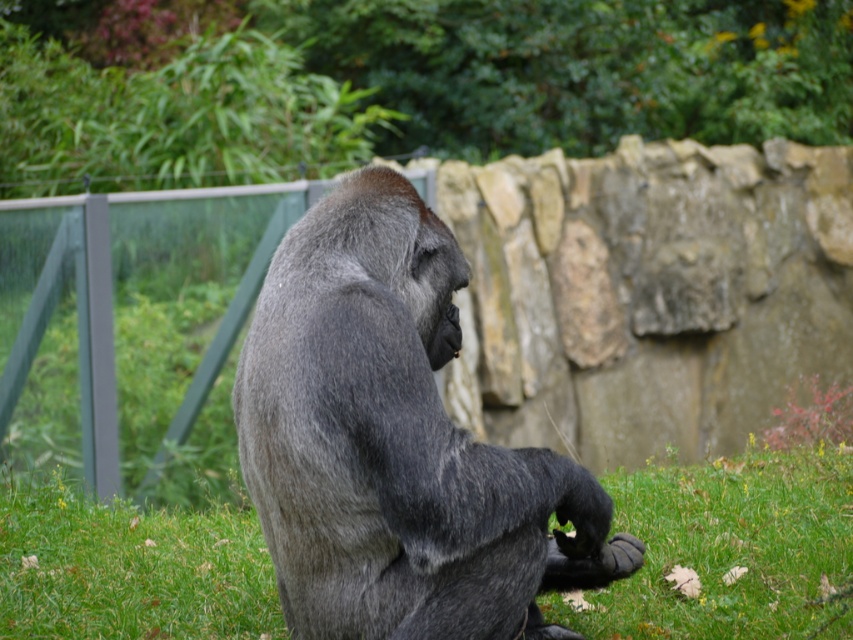
You are a zookeeper observing the gray fur gorilla at center and the green soft grass at center. Which object is positioned more to the right side of the image?

The green soft grass at center is positioned more to the right side of the image because the gray fur gorilla at center is to the left of it.

You are a zookeeper who needs to ensure that the gray fur gorilla at center has enough space to move freely. Considering the green soft grass at center, which object takes up more vertical space in the enclosure?

The gray fur gorilla at center is much taller than the green soft grass at center, so it takes up more vertical space in the enclosure.

Consider the image. You are a zookeeper observing the gray fur gorilla at center and the green soft grass at center in the enclosure. Which object is closer to you?

The gray fur gorilla at center is closer to you because it is in front of the green soft grass at center.